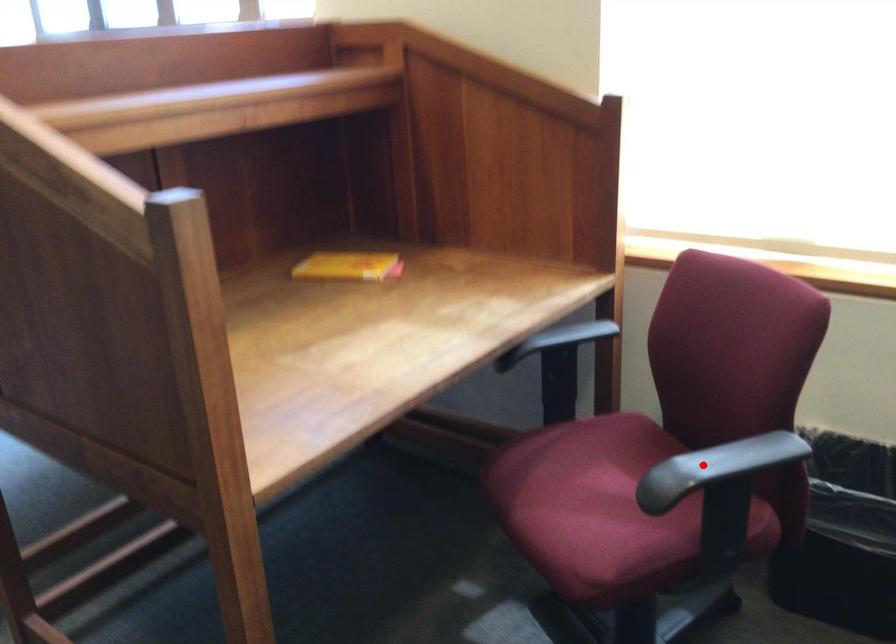
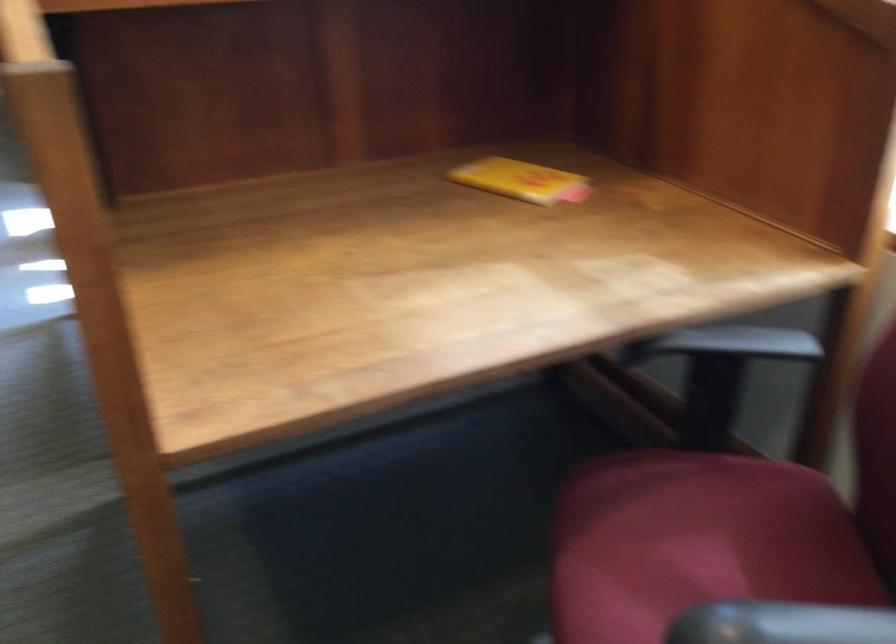
Question: I am providing you with two images of the same scene from different viewpoints. A red point is shown in image1. For the corresponding object point in image2, is it positioned nearer or farther from the camera?

Choices:
 (A) Nearer
 (B) Farther

Answer: (A)